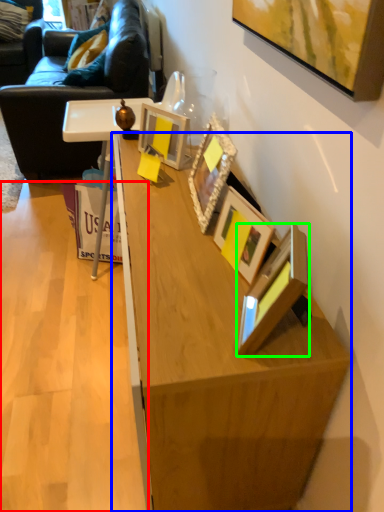
Question: Estimate the real-world distances between objects in this image. Which object is farther from plywood (highlighted by a red box), desk (highlighted by a blue box) or picture frame (highlighted by a green box)?

Choices:
 (A) desk
 (B) picture frame

Answer: (B)